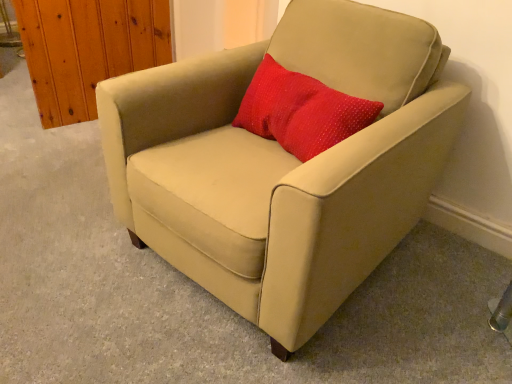
Question: Considering the positions of beige fabric armchair at center and red dotted fabric pillow at center in the image, is beige fabric armchair at center wider or thinner than red dotted fabric pillow at center?

Choices:
 (A) thin
 (B) wide

Answer: (B)

Question: From a real-world perspective, relative to red dotted fabric pillow at center, is beige fabric armchair at center vertically above or below?

Choices:
 (A) below
 (B) above

Answer: (A)

Question: In the image, is beige fabric armchair at center positioned in front of or behind red dotted fabric pillow at center?

Choices:
 (A) front
 (B) behind

Answer: (A)

Question: Choose the correct answer: Is red dotted fabric pillow at center inside beige fabric armchair at center or outside it?

Choices:
 (A) inside
 (B) outside

Answer: (A)

Question: Is point coord(336,119) closer or farther from the camera than point coord(314,193)?

Choices:
 (A) farther
 (B) closer

Answer: (A)

Question: In terms of width, does red dotted fabric pillow at center look wider or thinner when compared to beige fabric armchair at center?

Choices:
 (A) wide
 (B) thin

Answer: (B)

Question: Is red dotted fabric pillow at center in front of or behind beige fabric armchair at center in the image?

Choices:
 (A) front
 (B) behind

Answer: (B)